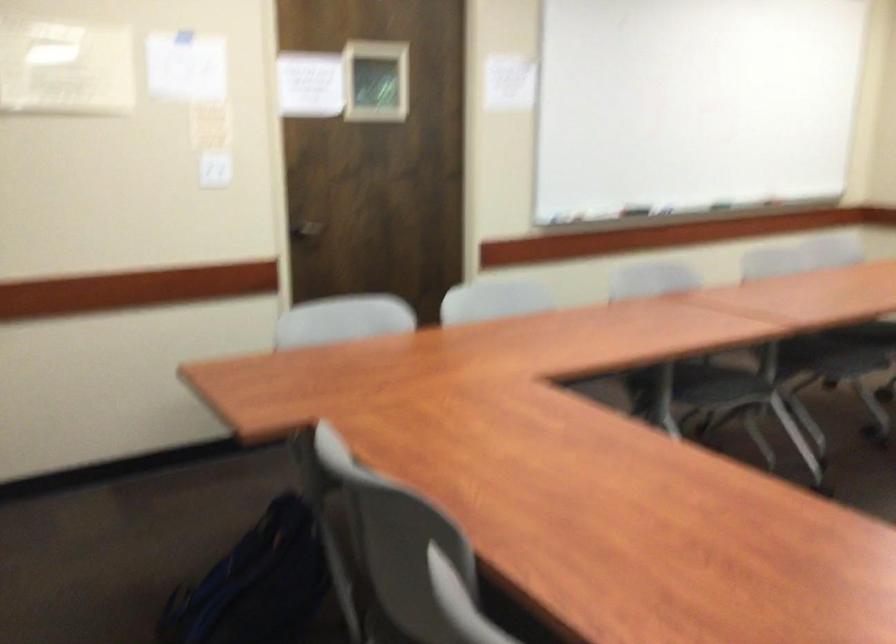
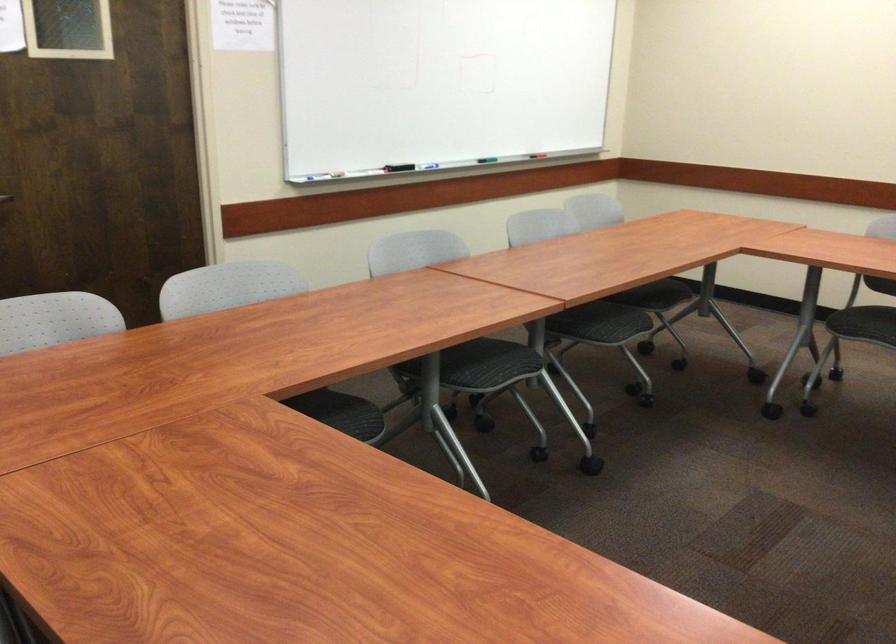
Where in the second image is the point corresponding to (686,128) from the first image?

(438, 82)